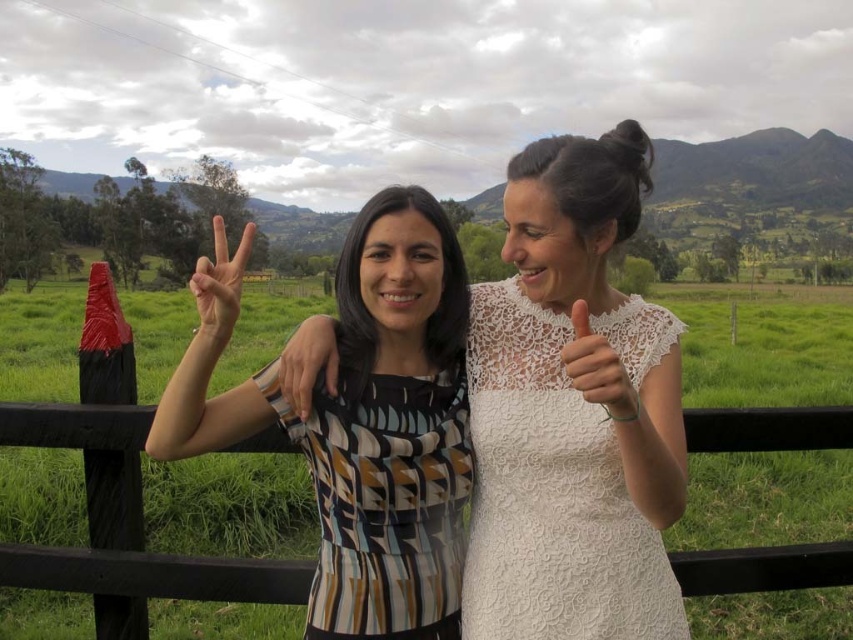
You are a photographer at a countryside event and need to ensure that both the white lace dress at center and the white lace hand at center are visible in your shot. Given that the dress is larger, which object should you focus on to frame the shot properly?

The white lace dress at center is bigger than the white lace hand at center, so you should focus on the white lace dress at center to frame the shot properly since it takes up more space in the image.

You are a photographer trying to capture a photo of the two subjects in the scene. You notice the patterned fabric dress at center and the white lace hand at center. Which object is positioned to the left of the other?

The patterned fabric dress at center is to the left of the white lace hand at center according to the description.

You are a photographer trying to capture a closeup shot of both the patterned fabric dress at center and the white lace hand at center. Given the current distance between them, can you fit both subjects into your camera frame without moving either of them?

The distance between the patterned fabric dress at center and the white lace hand at center is 38.11 inches. To determine if both can fit, you need to know your camera frame width. If your camera can capture a width of at least 38.11 inches at your current distance, then yes, both subjects can be included without moving them.